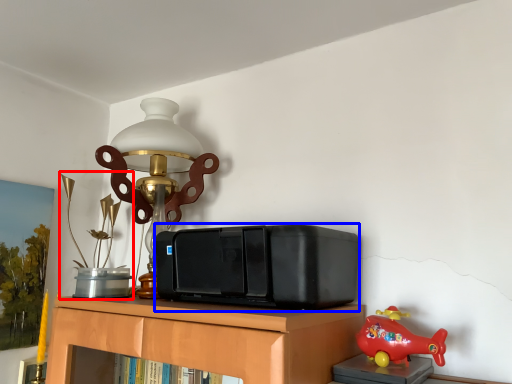
Question: Which object is further to the camera taking this photo, toy (highlighted by a red box) or stereo (highlighted by a blue box)?

Choices:
 (A) toy
 (B) stereo

Answer: (A)